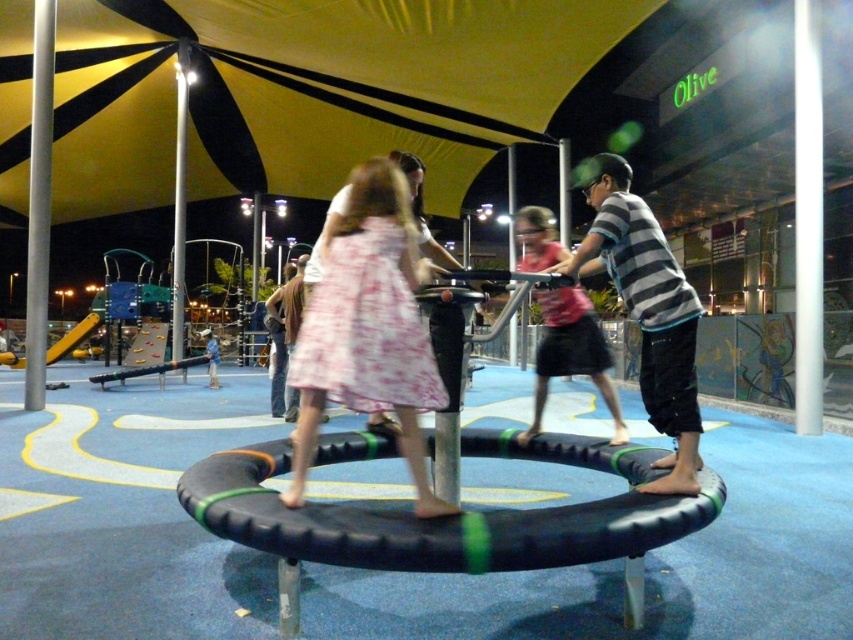
Who is taller, black rubber tire at center or pink fabric dress at center?

With more height is pink fabric dress at center.

Between point (260, 538) and point (527, 211), which one is positioned behind?

Positioned behind is point (527, 211).

At what (x,y) coordinates should I click in order to perform the action: click on black rubber tire at center. Please return your answer as a coordinate pair (x, y). Looking at the image, I should click on (448, 516).

Can you confirm if floral dress at center is positioned above pink fabric dress at center?

Actually, floral dress at center is below pink fabric dress at center.

At what (x,y) coordinates should I click in order to perform the action: click on floral dress at center. Please return your answer as a coordinate pair (x, y). The width and height of the screenshot is (853, 640). Looking at the image, I should click on (368, 330).

Between point (373, 308) and point (556, 371), which one is positioned behind?

Positioned behind is point (556, 371).

The image size is (853, 640). Identify the location of floral dress at center. (368, 330).

Which is in front, point (378, 236) or point (614, 195)?

Point (378, 236) is more forward.

Does floral dress at center have a greater height compared to striped cotton shirt at center?

Correct, floral dress at center is much taller as striped cotton shirt at center.

Does point (335, 312) come behind point (683, 440)?

No, it is in front of (683, 440).

Locate an element on the screen. floral dress at center is located at coordinates (368, 330).